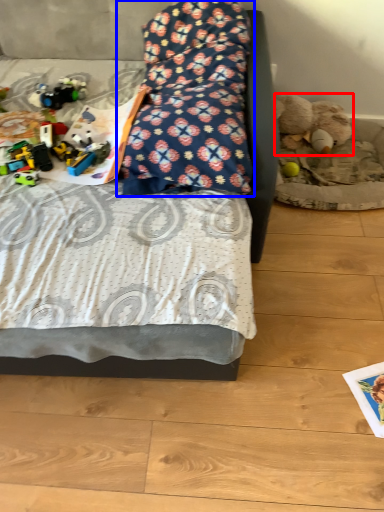
Question: Among these objects, which one is nearest to the camera, teddy bear (highlighted by a red box) or pillow (highlighted by a blue box)?

Choices:
 (A) teddy bear
 (B) pillow

Answer: (B)